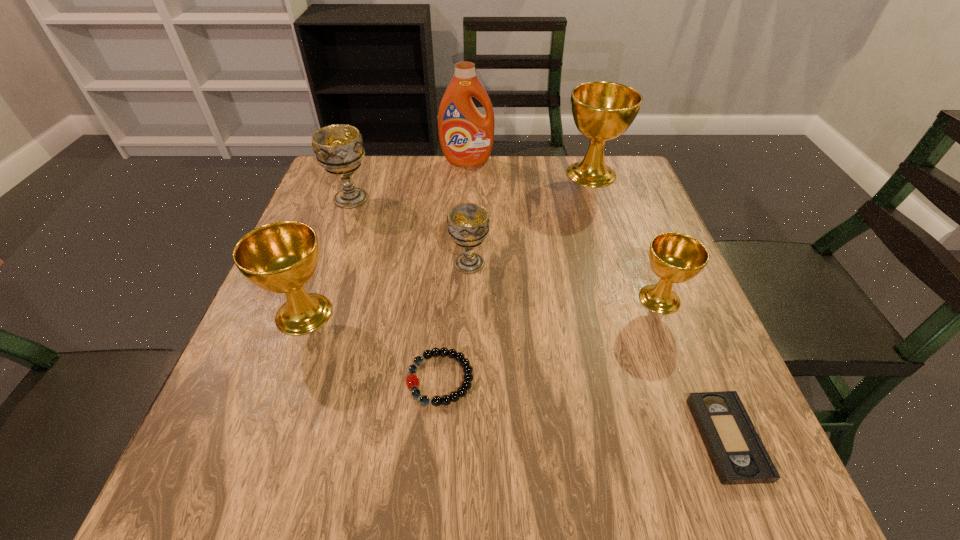
In the image, there is a desktop. At what (x,y) coordinates should I click in order to perform the action: click on vacant space at the far right corner. Please return your answer as a coordinate pair (x, y). Looking at the image, I should click on (591, 197).

You are a GUI agent. You are given a task and a screenshot of the screen. Output one action in this format:
    pyautogui.click(x=<x>, y=<y>)
    Task: Click on the free area in between the seventh shortest object and the detergent
    The height and width of the screenshot is (540, 960).
    Given the screenshot: What is the action you would take?
    click(529, 167)

Where is `empty space that is in between the detergent and the bigger white chalice`? This screenshot has height=540, width=960. empty space that is in between the detergent and the bigger white chalice is located at coordinates (409, 180).

The width and height of the screenshot is (960, 540). I want to click on vacant region between the detergent and the bracelet, so click(454, 270).

Where is `free spot between the smallest gold chalice and the second biggest gold chalice`? This screenshot has width=960, height=540. free spot between the smallest gold chalice and the second biggest gold chalice is located at coordinates (482, 306).

The image size is (960, 540). What are the coordinates of `free space between the videotape and the black bracelet` in the screenshot? It's located at (584, 408).

Identify the location of free space that is in between the detergent and the smallest gold chalice. This screenshot has width=960, height=540. (564, 230).

The image size is (960, 540). Identify the location of blank region between the biggest gold chalice and the second biggest gold chalice. (447, 244).

You are a GUI agent. You are given a task and a screenshot of the screen. Output one action in this format:
    pyautogui.click(x=<x>, y=<y>)
    Task: Click on the free spot between the bigger white chalice and the leftmost gold chalice
    
    Given the screenshot: What is the action you would take?
    pyautogui.click(x=327, y=256)

Locate an element on the screen. vacant area between the biggest gold chalice and the detergent is located at coordinates (529, 167).